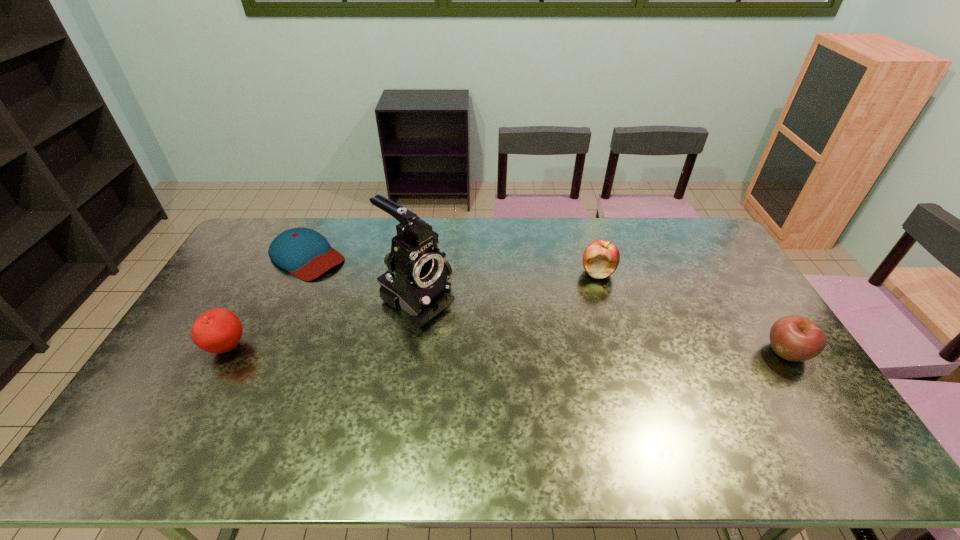
The image size is (960, 540). Find the location of `free space between the leftmost apple and the third object from right to left`. free space between the leftmost apple and the third object from right to left is located at coordinates (323, 325).

Find the location of a particular element. empty space between the rightmost apple and the leftmost apple is located at coordinates (508, 350).

This screenshot has width=960, height=540. I want to click on vacant region between the farthest apple and the fourth tallest object, so click(692, 312).

The image size is (960, 540). I want to click on unoccupied position between the rightmost object and the camcorder, so click(602, 327).

At what (x,y) coordinates should I click in order to perform the action: click on free space between the third object from left to right and the baseball cap. Please return your answer as a coordinate pair (x, y). The image size is (960, 540). Looking at the image, I should click on (362, 280).

Where is `free spot between the leftmost apple and the shortest object`? This screenshot has width=960, height=540. free spot between the leftmost apple and the shortest object is located at coordinates (267, 302).

I want to click on free area in between the second apple from left to right and the rightmost apple, so click(x=692, y=312).

At what (x,y) coordinates should I click in order to perform the action: click on free space between the baseball cap and the tallest object. Please return your answer as a coordinate pair (x, y). The height and width of the screenshot is (540, 960). Looking at the image, I should click on (362, 280).

I want to click on object that is the second closest to the camcorder, so click(x=218, y=330).

Locate which object is the second closest to the rightmost apple. Please provide its 2D coordinates. Your answer should be formatted as a tuple, i.e. [(x, y)], where the tuple contains the x and y coordinates of a point satisfying the conditions above.

[(416, 281)]